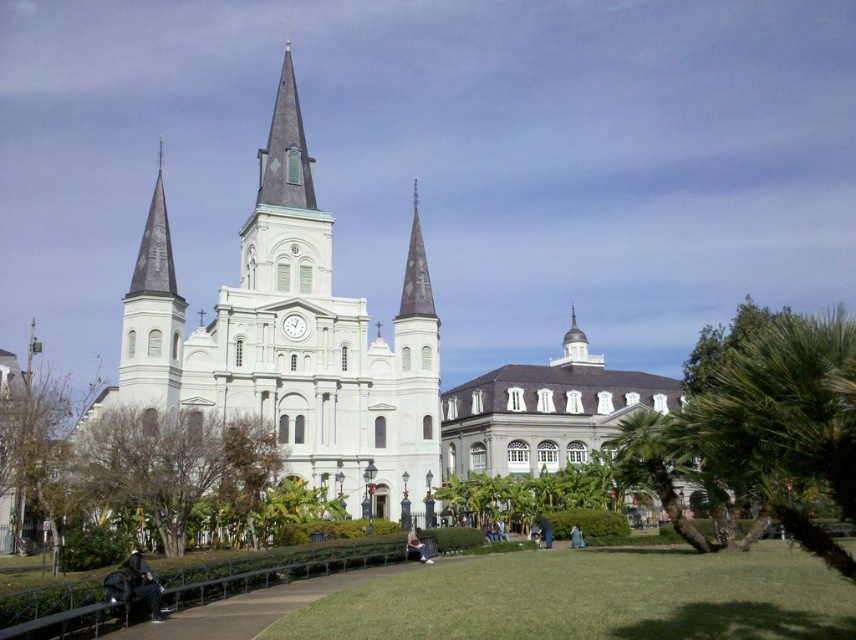
You are a photographer planning to capture the church and its surroundings. You notice the white glossy clock at center and the blue jeans at lower right in your frame. Which object appears wider in the photo?

The white glossy clock at center appears wider in the photo because its width surpasses that of the blue jeans at lower right.

You are standing at the entrance of the historic church and notice the green grass at center and the blue jeans at lower right. Which object is located to the right of the other?

The green grass at center is positioned on the right side of blue jeans at lower right, so the green grass at center is to the right of the blue jeans at lower right.

You are standing on the grassy area in front of the historic church and notice two pairs of jeans. The first pair, dark blue jeans at lower left, is near the curved pathway, and the second pair, blue jeans at lower right, is further along the path. From your vantage point, which pair of jeans appears higher in the image?

The dark blue jeans at lower left appears higher in the image because it is located above the blue jeans at lower right.